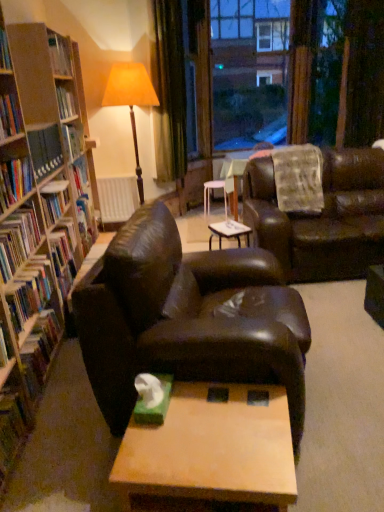
Image resolution: width=384 pixels, height=512 pixels. Identify the location of spots to the right of wooden coffee table at center, which is counted as the first table, starting from the front. (332, 462).